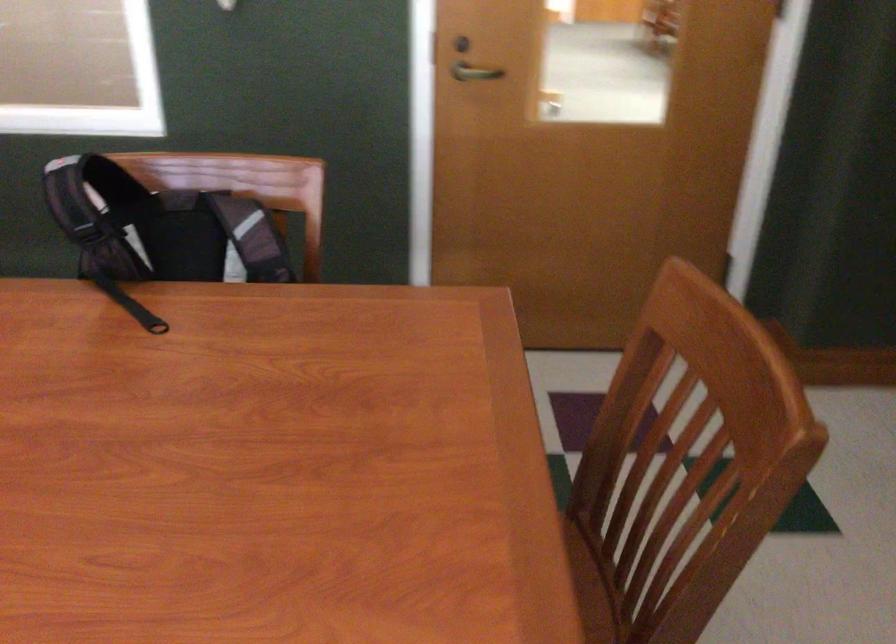
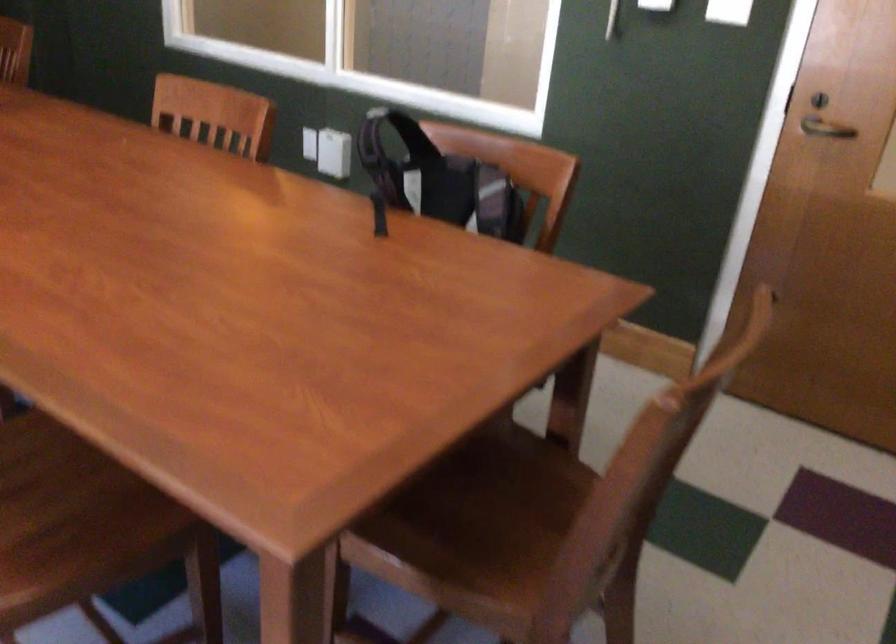
In the second image, find the point that corresponds to the point at 165,230 in the first image.

(438, 180)